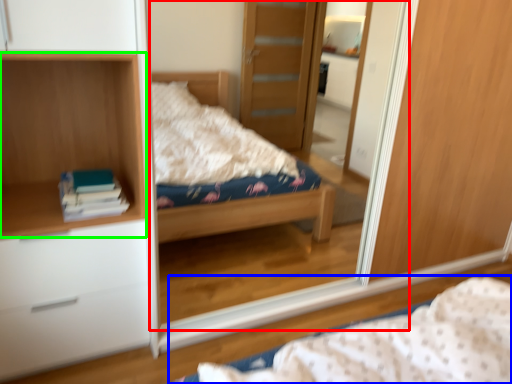
Question: Which object is the closest to the mirror (highlighted by a red box)? Choose among these: bed (highlighted by a blue box) or cabinet (highlighted by a green box).

Choices:
 (A) bed
 (B) cabinet

Answer: (B)